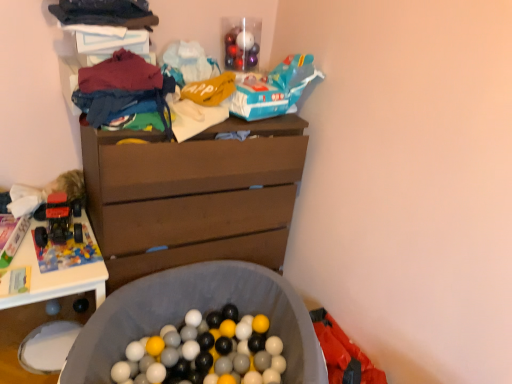
Question: From the image's perspective, is brown wood chest of drawers at center on top of white plastic table at left?

Choices:
 (A) yes
 (B) no

Answer: (A)

Question: Is brown wood chest of drawers at center bigger than white plastic table at left?

Choices:
 (A) yes
 (B) no

Answer: (A)

Question: Does brown wood chest of drawers at center have a lesser width compared to white plastic table at left?

Choices:
 (A) no
 (B) yes

Answer: (B)

Question: Is brown wood chest of drawers at center facing away from white plastic table at left?

Choices:
 (A) yes
 (B) no

Answer: (B)

Question: Is brown wood chest of drawers at center not within white plastic table at left?

Choices:
 (A) no
 (B) yes

Answer: (B)

Question: From the image's perspective, relative to white plastic table at left, is dark blue fabric at upper left, acting as the 1th clothing starting from the top, above or below?

Choices:
 (A) below
 (B) above

Answer: (B)

Question: Is dark blue fabric at upper left, positioned as the 2th clothing in bottom-to-top order, situated inside white plastic table at left or outside?

Choices:
 (A) outside
 (B) inside

Answer: (A)

Question: Relative to white plastic table at left, is dark blue fabric at upper left, acting as the 1th clothing starting from the top, in front or behind?

Choices:
 (A) front
 (B) behind

Answer: (A)

Question: Visually, is dark blue fabric at upper left, positioned as the 2th clothing in bottom-to-top order, positioned to the left or to the right of white plastic table at left?

Choices:
 (A) right
 (B) left

Answer: (A)

Question: Would you say dark blue fabric at upper left, acting as the 1th clothing starting from the top, is to the left or to the right of gray fabric laundry basket at lower center in the picture?

Choices:
 (A) left
 (B) right

Answer: (A)

Question: From a real-world perspective, relative to gray fabric laundry basket at lower center, is dark blue fabric at upper left, positioned as the 2th clothing in bottom-to-top order, vertically above or below?

Choices:
 (A) above
 (B) below

Answer: (A)

Question: Is dark blue fabric at upper left, positioned as the 2th clothing in bottom-to-top order, spatially inside gray fabric laundry basket at lower center, or outside of it?

Choices:
 (A) inside
 (B) outside

Answer: (B)

Question: From their relative heights in the image, would you say dark blue fabric at upper left, acting as the 1th clothing starting from the top, is taller or shorter than gray fabric laundry basket at lower center?

Choices:
 (A) tall
 (B) short

Answer: (B)

Question: Is matte blue jeans at upper left, positioned as the 1th clothing in bottom-to-top order, wider or thinner than brown wood chest of drawers at center?

Choices:
 (A) wide
 (B) thin

Answer: (B)

Question: Looking at the image, does matte blue jeans at upper left, positioned as the 1th clothing in bottom-to-top order, seem bigger or smaller compared to brown wood chest of drawers at center?

Choices:
 (A) small
 (B) big

Answer: (A)